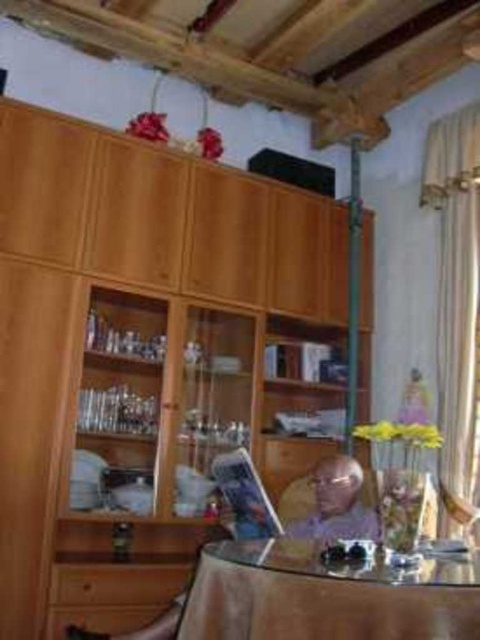
You are planning to place a large decorative item on the transparent glass table at center and the light purple fabric at center. Which surface can accommodate the larger item based on their sizes?

The transparent glass table at center has a larger size compared to light purple fabric at center, so it can accommodate the larger decorative item.

You are arranging flowers for a centerpiece. The transparent glass table at center is where you want to place the vase. However, there is already a light purple fabric at center on the table. Based on their positions, which object is on the left side of the other?

The light purple fabric at center is to the left of the transparent glass table at center.

You are standing in the living room and want to place a 7 feet long object on the transparent glass table at center. Can you fit it on the table?

The transparent glass table at center is 6.73 feet away from the camera, but the description does not provide information about the table dimensions. Therefore, it is impossible to determine if the 7 feet long object can fit on the table.